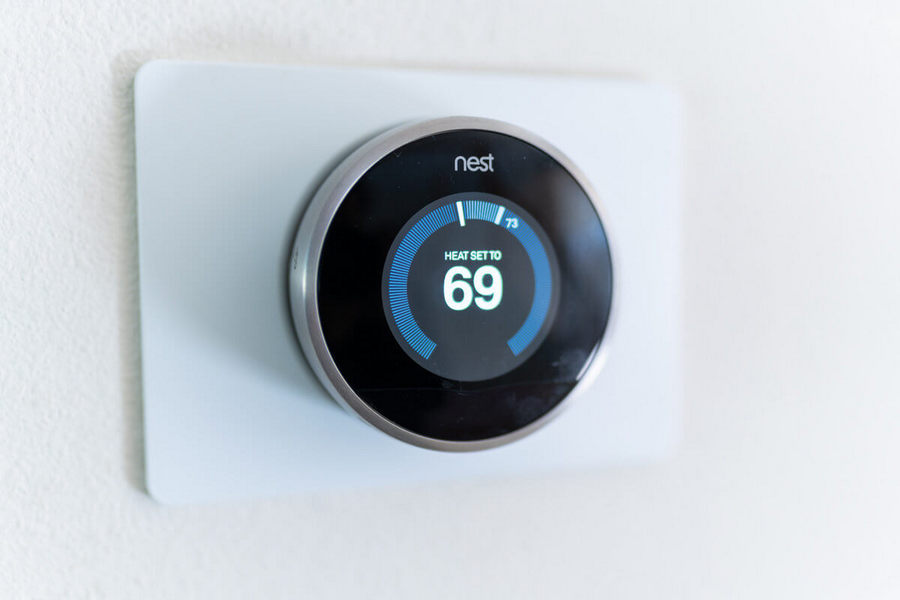
Find the location of `silver thermostat outline`. silver thermostat outline is located at coordinates (343, 191).